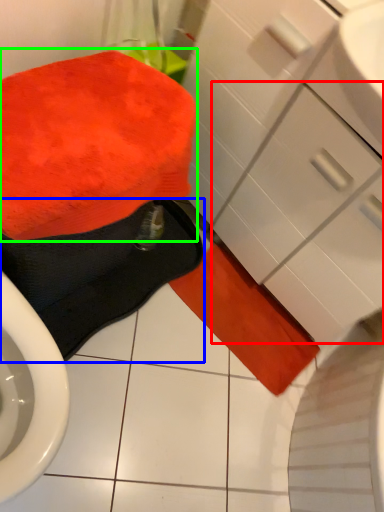
Question: Considering the real-world distances, which object is farthest from drawer (highlighted by a red box)? bath towel (highlighted by a blue box) or bath towel (highlighted by a green box)?

Choices:
 (A) bath towel
 (B) bath towel

Answer: (A)